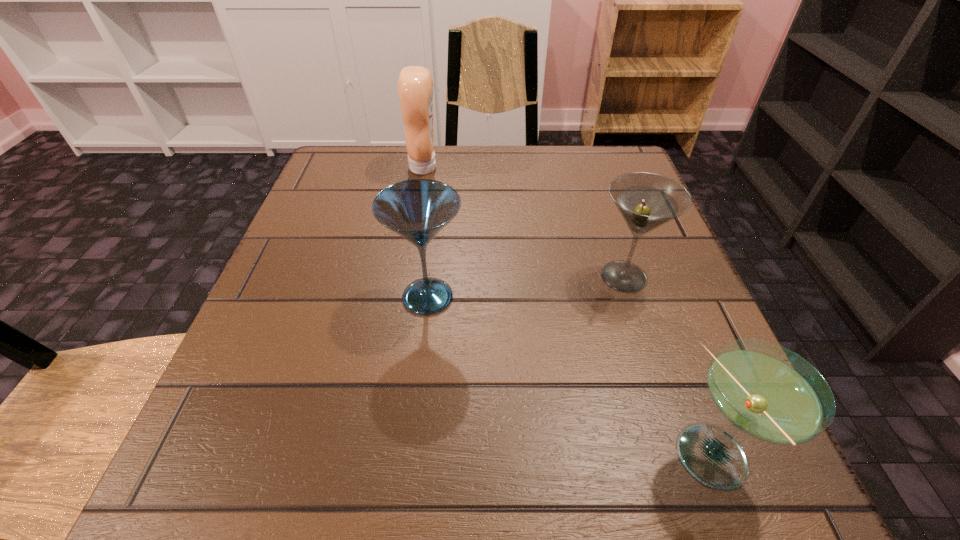
At what (x,y) coordinates should I click in order to perform the action: click on vacant space that satisfies the following two spatial constraints: 1. on the back side of the leftmost martini; 2. on the label of the condiment. Please return your answer as a coordinate pair (x, y). This screenshot has height=540, width=960. Looking at the image, I should click on (443, 167).

This screenshot has height=540, width=960. What are the coordinates of `free location that satisfies the following two spatial constraints: 1. on the label of the condiment; 2. on the left side of the leftmost martini` in the screenshot? It's located at (401, 297).

Where is `vacant space that satisfies the following two spatial constraints: 1. on the label of the farthest object; 2. on the left side of the nearest object`? vacant space that satisfies the following two spatial constraints: 1. on the label of the farthest object; 2. on the left side of the nearest object is located at coordinates (374, 458).

Locate an element on the screen. This screenshot has width=960, height=540. vacant region that satisfies the following two spatial constraints: 1. on the front side of the nearest object; 2. on the left side of the leftmost martini is located at coordinates (410, 458).

Where is `free space that satisfies the following two spatial constraints: 1. on the label of the farthest object; 2. on the right side of the nearest object`? free space that satisfies the following two spatial constraints: 1. on the label of the farthest object; 2. on the right side of the nearest object is located at coordinates (374, 458).

Locate an element on the screen. The height and width of the screenshot is (540, 960). free space that satisfies the following two spatial constraints: 1. on the back side of the nearest object; 2. on the label of the farthest object is located at coordinates (604, 167).